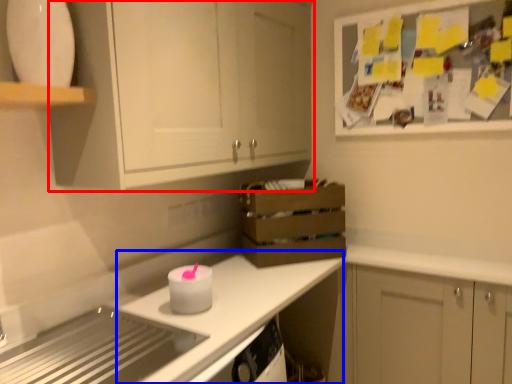
Question: Which point is closer to the camera, cabinetry (highlighted by a red box) or counter top (highlighted by a blue box)?

Choices:
 (A) cabinetry
 (B) counter top

Answer: (A)